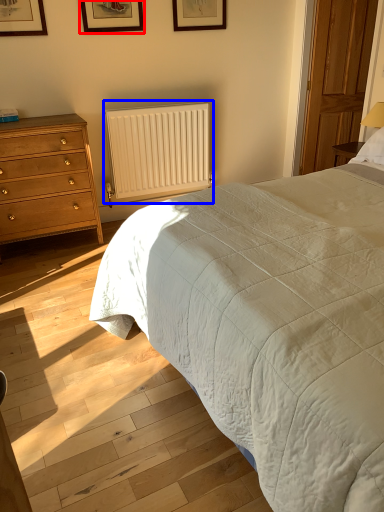
Question: Which of the following is the farthest to the observer, picture frame (highlighted by a red box) or radiator (highlighted by a blue box)?

Choices:
 (A) picture frame
 (B) radiator

Answer: (B)